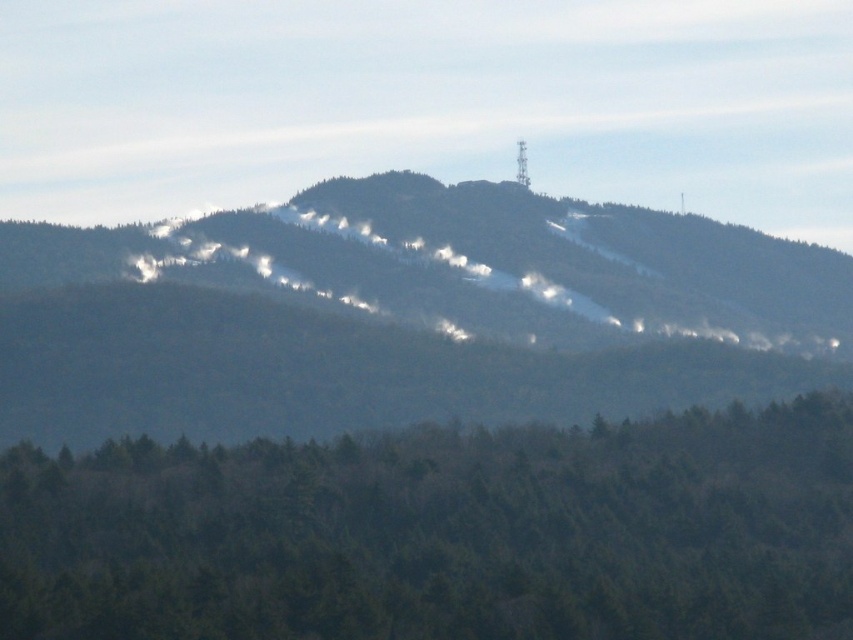
Question: Which object appears farthest from the camera in this image?

Choices:
 (A) snowy forested mountain at center
 (B) green matte trees at lower center

Answer: (A)

Question: Is snowy forested mountain at center positioned before green matte trees at lower center?

Choices:
 (A) no
 (B) yes

Answer: (A)

Question: Which object is farther from the camera taking this photo?

Choices:
 (A) snowy forested mountain at center
 (B) green matte trees at lower center

Answer: (A)

Question: Among these points, which one is farthest from the camera?

Choices:
 (A) (659, 518)
 (B) (57, 339)

Answer: (B)

Question: Is snowy forested mountain at center to the right of green matte trees at lower center from the viewer's perspective?

Choices:
 (A) yes
 (B) no

Answer: (A)

Question: In this image, where is snowy forested mountain at center located relative to green matte trees at lower center?

Choices:
 (A) right
 (B) left

Answer: (A)